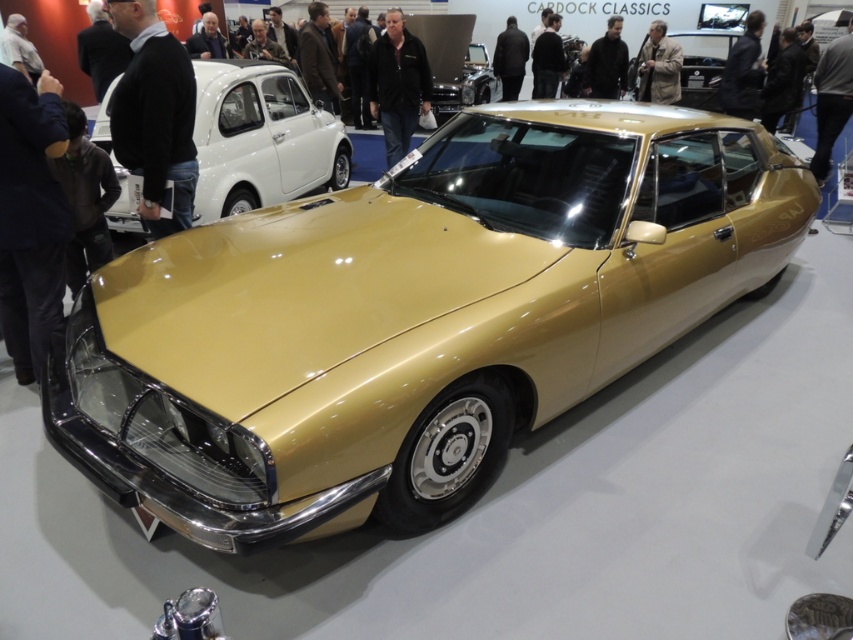
Between point (250, 396) and point (479, 81), which one is positioned in front?

Positioned in front is point (250, 396).

Is metallic gold car at center below gold metallic car at center?

Correct, metallic gold car at center is located below gold metallic car at center.

Image resolution: width=853 pixels, height=640 pixels. Find the location of `metallic gold car at center`. metallic gold car at center is located at coordinates (415, 316).

Find the location of a particular element. metallic gold car at center is located at coordinates (415, 316).

Locate an element on the screen. The height and width of the screenshot is (640, 853). brown leather jacket at center is located at coordinates (318, 58).

Describe the element at coordinates (318, 58) in the screenshot. I see `brown leather jacket at center` at that location.

This screenshot has height=640, width=853. I want to click on brown leather jacket at center, so click(x=318, y=58).

Looking at this image, is white glossy compact car at center to the left of black leather jacket at upper center from the viewer's perspective?

Correct, you'll find white glossy compact car at center to the left of black leather jacket at upper center.

Is white glossy compact car at center taller than black leather jacket at upper center?

Correct, white glossy compact car at center is much taller as black leather jacket at upper center.

At what (x,y) coordinates should I click in order to perform the action: click on white glossy compact car at center. Please return your answer as a coordinate pair (x, y). The image size is (853, 640). Looking at the image, I should click on (260, 138).